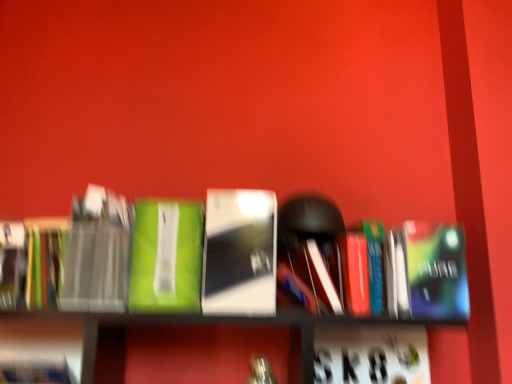
Describe the element at coordinates (167, 257) in the screenshot. This screenshot has height=384, width=512. I see `green matte book at center, the first book viewed from the left` at that location.

What do you see at coordinates (45, 261) in the screenshot?
I see `multicolored paper at left, the 2th paperback book in the left-to-right sequence` at bounding box center [45, 261].

This screenshot has width=512, height=384. What do you see at coordinates (240, 253) in the screenshot?
I see `metallic silver book at center, the second book from the left` at bounding box center [240, 253].

What do you see at coordinates (12, 263) in the screenshot?
I see `hardcover book at left, the 1th paperback book viewed from the left` at bounding box center [12, 263].

In order to click on green matte book at center, the first book viewed from the left in this screenshot , I will do `click(167, 257)`.

Consider the image. From a real-world perspective, is matte black book at left, which ranks as the 3th paperback book in left-to-right order, on top of hardcover book at left, the 4th paperback book from the right?

Yes.

Is matte black book at left, which ranks as the 3th paperback book in left-to-right order, aimed at hardcover book at left, the 1th paperback book viewed from the left?

No, matte black book at left, which ranks as the 3th paperback book in left-to-right order, does not turn towards hardcover book at left, the 1th paperback book viewed from the left.

Considering the relative sizes of matte black book at left, the second paperback book positioned from the right, and hardcover book at left, the 1th paperback book viewed from the left, in the image provided, is matte black book at left, the second paperback book positioned from the right, smaller than hardcover book at left, the 1th paperback book viewed from the left,?

No.

In the scene shown: Between metallic silver book at center, placed as the 1th book when sorted from right to left, and multicolored paper at left, the 2th paperback book in the left-to-right sequence, which one has less height?

multicolored paper at left, the 2th paperback book in the left-to-right sequence.

Identify the location of the 2nd paperback book directly beneath the metallic silver book at center, the second book from the left (from a real-world perspective). (45, 261).

Considering the sizes of objects metallic silver book at center, placed as the 1th book when sorted from right to left, and multicolored paper at left, which appears as the 3th paperback book when viewed from the right, in the image provided, who is wider, metallic silver book at center, placed as the 1th book when sorted from right to left, or multicolored paper at left, which appears as the 3th paperback book when viewed from the right,?

metallic silver book at center, placed as the 1th book when sorted from right to left.

Locate an element on the screen. This screenshot has width=512, height=384. the 1st paperback book positioned below the green matte book at center, the second book positioned from the right (from the image's perspective) is located at coordinates (45, 261).

Would you consider multicolored paper at left, the 2th paperback book in the left-to-right sequence, to be distant from green matte book at center, the second book positioned from the right?

No, multicolored paper at left, the 2th paperback book in the left-to-right sequence, is in close proximity to green matte book at center, the second book positioned from the right.

Looking at this image, how far apart are multicolored paper at left, which appears as the 3th paperback book when viewed from the right, and green matte book at center, the second book positioned from the right?

They are 11.26 inches apart.

Which of these two, multicolored paper at left, the 2th paperback book in the left-to-right sequence, or green matte book at center, the first book viewed from the left, is smaller?

multicolored paper at left, the 2th paperback book in the left-to-right sequence.

From a real-world perspective, who is located lower, hardcover book at left, the 4th paperback book from the right, or multicolored paper at left, which appears as the 3th paperback book when viewed from the right?

hardcover book at left, the 4th paperback book from the right.

Can you confirm if hardcover book at left, the 4th paperback book from the right, is thinner than multicolored paper at left, the 2th paperback book in the left-to-right sequence?

In fact, hardcover book at left, the 4th paperback book from the right, might be wider than multicolored paper at left, the 2th paperback book in the left-to-right sequence.

From the image's perspective, between hardcover book at left, the 1th paperback book viewed from the left, and multicolored paper at left, the 2th paperback book in the left-to-right sequence, who is located below?

hardcover book at left, the 1th paperback book viewed from the left, from the image's perspective.

From a real-world perspective, which object stands above the other?

green matte book at center, the second book positioned from the right, is physically above.

Is green matte book at center, the second book positioned from the right, touching metallic blue paperback book at center right, which is counted as the 4th paperback book, starting from the left?

green matte book at center, the second book positioned from the right, and metallic blue paperback book at center right, which is counted as the 4th paperback book, starting from the left, are clearly separated.

Between green matte book at center, the first book viewed from the left, and metallic blue paperback book at center right, which is counted as the 4th paperback book, starting from the left, which one has larger size?

Bigger between the two is green matte book at center, the first book viewed from the left.

Which of these two, green matte book at center, the second book positioned from the right, or metallic blue paperback book at center right, which is counted as the 4th paperback book, starting from the left, stands taller?

Standing taller between the two is green matte book at center, the second book positioned from the right.

Based on the photo, from a real-world perspective, which is physically below, metallic silver book at center, placed as the 1th book when sorted from right to left, or matte black book at left, the second paperback book positioned from the right?

matte black book at left, the second paperback book positioned from the right, from a real-world perspective.

Looking at the image, does metallic blue paperback book at center right, placed as the 1th paperback book when sorted from right to left, seem bigger or smaller compared to hardcover book at left, the 4th paperback book from the right?

metallic blue paperback book at center right, placed as the 1th paperback book when sorted from right to left, is bigger than hardcover book at left, the 4th paperback book from the right.

Looking at this image, can you confirm if metallic blue paperback book at center right, which is counted as the 4th paperback book, starting from the left, is shorter than hardcover book at left, the 1th paperback book viewed from the left?

Incorrect, the height of metallic blue paperback book at center right, which is counted as the 4th paperback book, starting from the left, does not fall short of that of hardcover book at left, the 1th paperback book viewed from the left.

Could you measure the distance between metallic blue paperback book at center right, which is counted as the 4th paperback book, starting from the left, and hardcover book at left, the 4th paperback book from the right?

metallic blue paperback book at center right, which is counted as the 4th paperback book, starting from the left, is 1.12 meters away from hardcover book at left, the 4th paperback book from the right.

Looking at this image, is metallic blue paperback book at center right, placed as the 1th paperback book when sorted from right to left, oriented away from hardcover book at left, the 4th paperback book from the right?

No, metallic blue paperback book at center right, placed as the 1th paperback book when sorted from right to left, is not facing away from hardcover book at left, the 4th paperback book from the right.

From the image's perspective, which paperback book is the 2nd one below the matte black book at left, which ranks as the 3th paperback book in left-to-right order? Please provide its 2D coordinates.

[(12, 263)]

From the image's perspective, starting from the multicolored paper at left, the 2th paperback book in the left-to-right sequence, which book is the 1st one above? Please provide its 2D coordinates.

[(240, 253)]

Looking at this image, when comparing their distances from hardcover book at left, the 4th paperback book from the right, does multicolored paper at left, the 2th paperback book in the left-to-right sequence, or matte black book at left, which ranks as the 3th paperback book in left-to-right order, seem further?

matte black book at left, which ranks as the 3th paperback book in left-to-right order, lies further to hardcover book at left, the 4th paperback book from the right, than the other object.

Estimate the real-world distances between objects in this image. Which object is closer to metallic blue paperback book at center right, which is counted as the 4th paperback book, starting from the left, green matte book at center, the second book positioned from the right, or hardcover book at left, the 4th paperback book from the right?

green matte book at center, the second book positioned from the right, is positioned closer to the anchor metallic blue paperback book at center right, which is counted as the 4th paperback book, starting from the left.

Considering their positions, is metallic silver book at center, placed as the 1th book when sorted from right to left, positioned further to matte black book at left, which ranks as the 3th paperback book in left-to-right order, than hardcover book at left, the 4th paperback book from the right?

metallic silver book at center, placed as the 1th book when sorted from right to left, is further to matte black book at left, which ranks as the 3th paperback book in left-to-right order.

From the image, which object appears to be farther from multicolored paper at left, which appears as the 3th paperback book when viewed from the right, metallic silver book at center, the second book from the left, or matte black book at left, the second paperback book positioned from the right?

The object further to multicolored paper at left, which appears as the 3th paperback book when viewed from the right, is metallic silver book at center, the second book from the left.

Which object lies nearer to the anchor point green matte book at center, the first book viewed from the left, matte black book at left, the second paperback book positioned from the right, or hardcover book at left, the 4th paperback book from the right?

Based on the image, matte black book at left, the second paperback book positioned from the right, appears to be nearer to green matte book at center, the first book viewed from the left.

When comparing their distances from metallic silver book at center, placed as the 1th book when sorted from right to left, does green matte book at center, the second book positioned from the right, or metallic blue paperback book at center right, which is counted as the 4th paperback book, starting from the left, seem closer?

green matte book at center, the second book positioned from the right, is closer to metallic silver book at center, placed as the 1th book when sorted from right to left.

Estimate the real-world distances between objects in this image. Which object is closer to green matte book at center, the second book positioned from the right, metallic silver book at center, the second book from the left, or matte black book at left, the second paperback book positioned from the right?

metallic silver book at center, the second book from the left, lies closer to green matte book at center, the second book positioned from the right, than the other object.

From the image, which object appears to be nearer to metallic silver book at center, the second book from the left, multicolored paper at left, which appears as the 3th paperback book when viewed from the right, or metallic blue paperback book at center right, which is counted as the 4th paperback book, starting from the left?

The object closer to metallic silver book at center, the second book from the left, is metallic blue paperback book at center right, which is counted as the 4th paperback book, starting from the left.

The height and width of the screenshot is (384, 512). What are the coordinates of `paperback book between multicolored paper at left, which appears as the 3th paperback book when viewed from the right, and metallic blue paperback book at center right, placed as the 1th paperback book when sorted from right to left` in the screenshot? It's located at (97, 253).

At what (x,y) coordinates should I click in order to perform the action: click on paperback book located between multicolored paper at left, which appears as the 3th paperback book when viewed from the right, and metallic silver book at center, the second book from the left, in the left-right direction. Please return your answer as a coordinate pair (x, y). The height and width of the screenshot is (384, 512). Looking at the image, I should click on (97, 253).

Identify the location of book between green matte book at center, the first book viewed from the left, and metallic blue paperback book at center right, placed as the 1th paperback book when sorted from right to left, in the horizontal direction. (240, 253).

The height and width of the screenshot is (384, 512). Find the location of `paperback book between multicolored paper at left, which appears as the 3th paperback book when viewed from the right, and green matte book at center, the second book positioned from the right, from left to right`. paperback book between multicolored paper at left, which appears as the 3th paperback book when viewed from the right, and green matte book at center, the second book positioned from the right, from left to right is located at coordinates (97, 253).